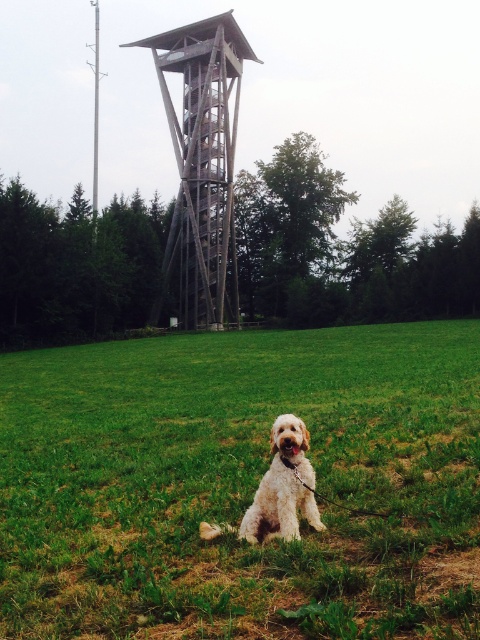
Can you confirm if wooden tower at center is bigger than golden fur dog at center?

Yes.

Does wooden tower at center have a greater height compared to golden fur dog at center?

Yes.

Is point (200, 298) positioned behind point (316, 516)?

Yes, point (200, 298) is behind point (316, 516).

Find the location of a particular element. The width and height of the screenshot is (480, 640). wooden tower at center is located at coordinates (203, 164).

Which is below, green grass at center or golden fur dog at center?

green grass at center

Can you confirm if green grass at center is shorter than golden fur dog at center?

Incorrect, green grass at center's height does not fall short of golden fur dog at center's.

Describe the element at coordinates (240, 484) in the screenshot. The height and width of the screenshot is (640, 480). I see `green grass at center` at that location.

Locate an element on the screen. This screenshot has width=480, height=640. green grass at center is located at coordinates (240, 484).

Is green grass at center to the right of wooden tower at center from the viewer's perspective?

Yes, green grass at center is to the right of wooden tower at center.

Who is more distant from viewer, (406,365) or (168,54)?

The point (168,54) is behind.

You are a GUI agent. You are given a task and a screenshot of the screen. Output one action in this format:
    pyautogui.click(x=<x>, y=<y>)
    Task: Click on the green grass at center
    The width and height of the screenshot is (480, 640).
    Given the screenshot: What is the action you would take?
    click(240, 484)